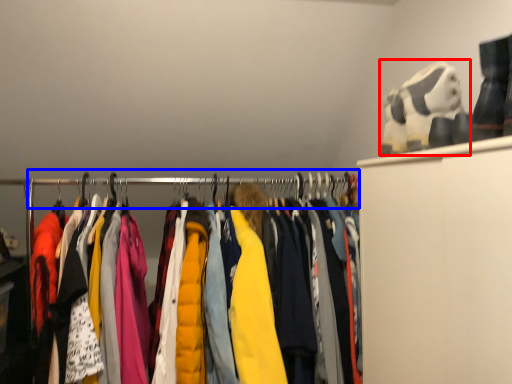
Question: Among these objects, which one is nearest to the camera, toy (highlighted by a red box) or clothesline (highlighted by a blue box)?

Choices:
 (A) toy
 (B) clothesline

Answer: (A)